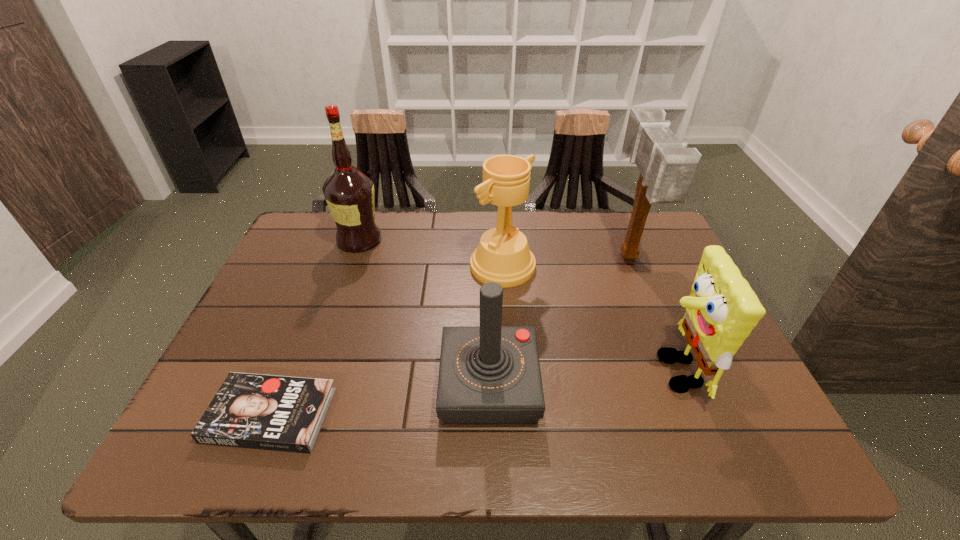
Locate an element on the screen. The image size is (960, 540). book that is at the near edge is located at coordinates (282, 413).

Where is `alcohol that is at the left edge`? alcohol that is at the left edge is located at coordinates (349, 193).

I want to click on book present at the left edge, so click(x=282, y=413).

Identify the location of mallet at the right edge. (667, 167).

Find the location of a particular element. sponge situated at the right edge is located at coordinates (721, 311).

The width and height of the screenshot is (960, 540). In order to click on object present at the far left corner in this screenshot , I will do `click(349, 193)`.

The height and width of the screenshot is (540, 960). What are the coordinates of `object at the near left corner` in the screenshot? It's located at (282, 413).

Locate an element on the screen. object that is at the far right corner is located at coordinates (667, 167).

Image resolution: width=960 pixels, height=540 pixels. In order to click on vacant space at the far edge in this screenshot , I will do `click(410, 221)`.

The width and height of the screenshot is (960, 540). Identify the location of vacant space at the near edge of the desktop. (687, 460).